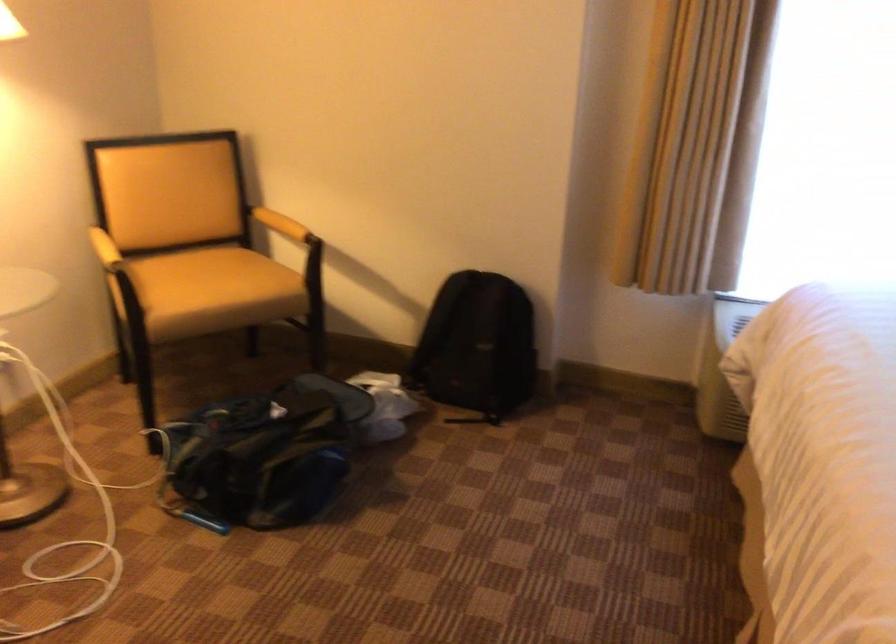
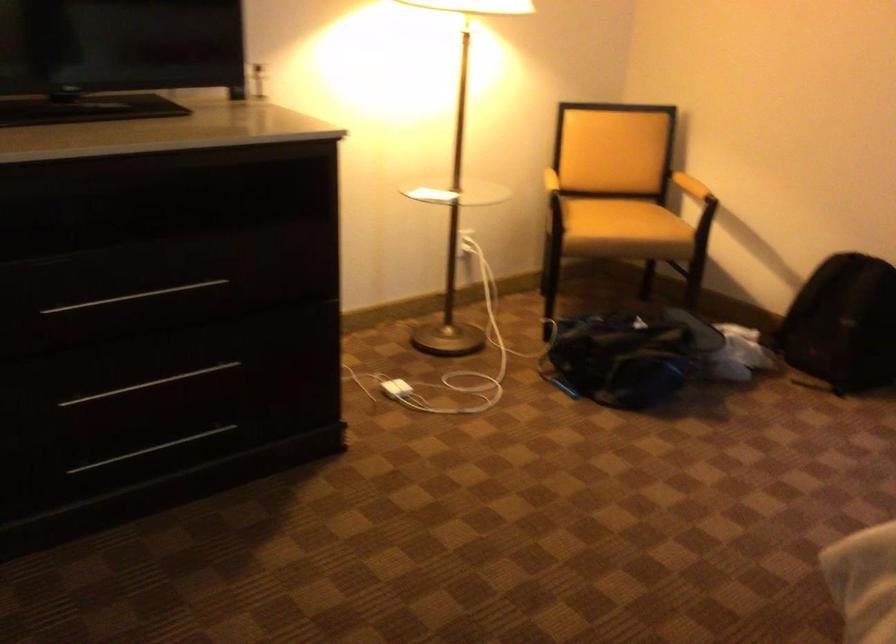
Where in the second image is the point corresponding to (x=488, y=362) from the first image?

(842, 324)